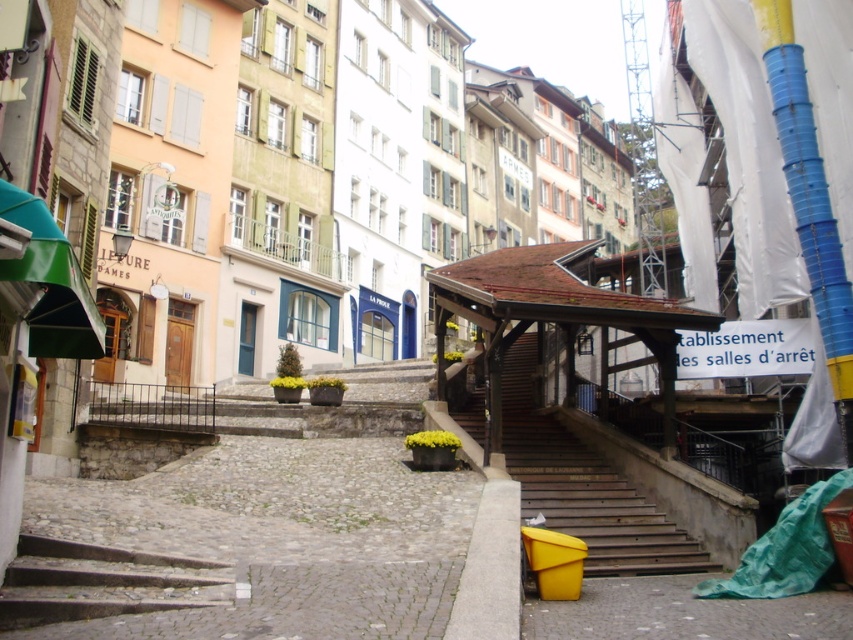
You are a tourist standing at the bottom of the dark gray concrete stairs at lower left, wanting to reach the wooden stairs at center. Which direction should you walk to get there?

The wooden stairs at center is larger in size than the dark gray concrete stairs at lower left, so you should walk towards the center of the image to reach the wooden stairs at center from the dark gray concrete stairs at lower left.

You are a delivery person carrying a large package that is 2 meters wide. You need to move through the street depicted in the scene. Can you pass through the space between the wooden stairs at center and the dark gray concrete stairs at lower left? Explain your reasoning.

The wooden stairs at center are wider than the dark gray concrete stairs at lower left. However, the exact width difference isn not specified. Without knowing the minimum required width for the package, it is impossible to determine if the space between them is sufficient. The question mentions the package is 2 meters wide, but the description only states a comparative width, not absolute measurements. Thus, the answer cannot be definitively determined from the given information.

You are standing on the European street scene and want to take a photo of both the point at coordinates (662, 550) and the point at (115, 598). Which point should you focus on first to ensure both are in focus?

You should focus on the point at (662, 550) first because it is closer to the camera compared to the point at (115, 598). This way, the depth of field will likely cover both points when focused on the closer one.